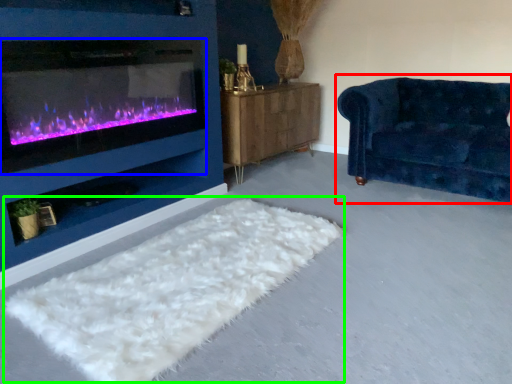
Question: Estimate the real-world distances between objects in this image. Which object is closer to studio couch (highlighted by a red box), wood burning stove (highlighted by a blue box) or mat (highlighted by a green box)?

Choices:
 (A) wood burning stove
 (B) mat

Answer: (B)